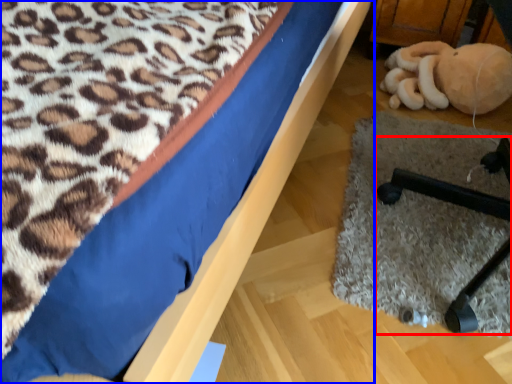
Question: Among these objects, which one is farthest to the camera, furniture (highlighted by a red box) or bed (highlighted by a blue box)?

Choices:
 (A) furniture
 (B) bed

Answer: (A)